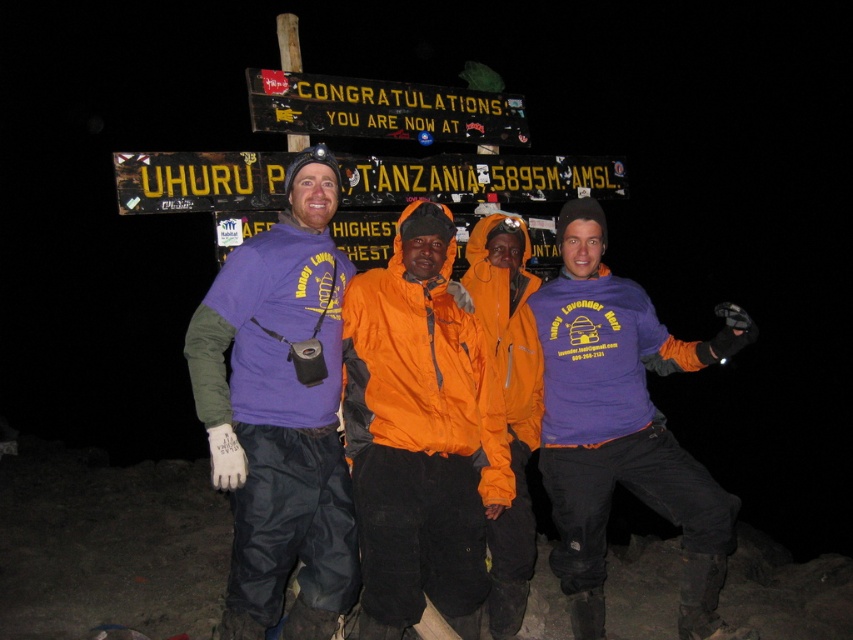
You are a photographer at Uhuru Peak and need to take a group photo of the climbers. The purple fabric shirt at center and the yellow plastic sign at upper center are both in your frame. Which object appears narrower in the photo?

The purple fabric shirt at center appears narrower in the photo because its width is less than that of the yellow plastic sign at upper center.

Consider the image. You are a drone operator trying to capture a photo of the signpost at Uhuru Peak. You have two points marked on your screen for positioning. The first point is at coordinates point (262, 257) and the second point is at coordinates point (509, 170). Which point should you use to ensure the signpost is fully visible in the frame?

Point (262, 257) is in front of point (509, 170), so using point (262, 257) will place the signpost closer to the camera and ensure it is fully visible in the frame.